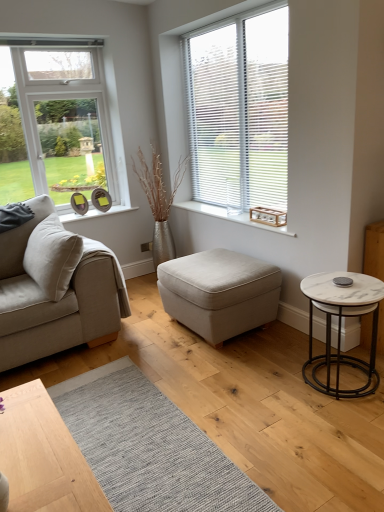
Identify the location of white blinds at upper right. (239, 111).

Image resolution: width=384 pixels, height=512 pixels. In order to click on light beige fabric ottoman at center in this screenshot , I will do `click(219, 292)`.

What is the approximate height of light beige fabric ottoman at center?

light beige fabric ottoman at center is 18.18 inches tall.

Identify the location of beige fabric couch at left. This screenshot has width=384, height=512. (55, 289).

Where is `white marble side table at right`? The image size is (384, 512). white marble side table at right is located at coordinates (340, 326).

I want to click on white blinds at upper right, so click(239, 111).

Between point (190, 324) and point (316, 368), which one is positioned behind?

Positioned behind is point (190, 324).

Is there a large distance between light beige fabric ottoman at center and white marble side table at right?

No, light beige fabric ottoman at center is in close proximity to white marble side table at right.

From a real-world perspective, is light beige fabric ottoman at center physically located above or below white marble side table at right?

In terms of real-world spatial position, light beige fabric ottoman at center is below white marble side table at right.

Which object is positioned more to the right, light beige fabric ottoman at center or white marble side table at right?

Positioned to the right is white marble side table at right.

Is beige fabric couch at left positioned with its back to white blinds at upper right?

That's not correct — beige fabric couch at left is not looking away from white blinds at upper right.

From a real-world perspective, is beige fabric couch at left on top of white blinds at upper right?

No, from a real-world perspective, beige fabric couch at left is not above white blinds at upper right.

Who is taller, beige fabric couch at left or white blinds at upper right?

white blinds at upper right.

Would you say white blinds at upper right is part of beige fabric couch at left's contents?

No, white blinds at upper right is not surrounded by beige fabric couch at left.

Considering the sizes of objects beige fabric couch at left and wooden crate at center in the image provided, who is shorter, beige fabric couch at left or wooden crate at center?

wooden crate at center.

Looking at the image, does beige fabric couch at left seem bigger or smaller compared to wooden crate at center?

Considering their sizes, beige fabric couch at left takes up more space than wooden crate at center.

Is beige fabric couch at left inside or outside of wooden crate at center?

beige fabric couch at left is spatially situated outside wooden crate at center.

From the image's perspective, is beige fabric couch at left over wooden crate at center?

No, from the image's perspective, beige fabric couch at left is not above wooden crate at center.

Considering their positions, is wooden crate at center located in front of or behind white blinds at upper right?

Visually, wooden crate at center is located behind white blinds at upper right.

The width and height of the screenshot is (384, 512). What are the coordinates of `window located above the wooden crate at center (from the image's perspective)` in the screenshot? It's located at (239, 111).

Is wooden crate at center smaller than white blinds at upper right?

Yes, wooden crate at center is smaller than white blinds at upper right.

Considering the sizes of objects white marble side table at right and light beige fabric ottoman at center in the image provided, who is thinner, white marble side table at right or light beige fabric ottoman at center?

white marble side table at right.

Which of these two, white marble side table at right or light beige fabric ottoman at center, stands shorter?

light beige fabric ottoman at center.

From a real-world perspective, who is located higher, white marble side table at right or light beige fabric ottoman at center?

white marble side table at right is physically above.

Based on the photo, in terms of height, does wooden crate at center look taller or shorter compared to light beige fabric ottoman at center?

A: wooden crate at center is shorter than light beige fabric ottoman at center.

Which is behind, wooden crate at center or light beige fabric ottoman at center?

Positioned behind is wooden crate at center.

This screenshot has height=512, width=384. I want to click on stool located underneath the wooden crate at center (from a real-world perspective), so click(219, 292).

Identify the location of window sill behind the white blinds at upper right. Image resolution: width=384 pixels, height=512 pixels. (231, 216).

Can you confirm if white blinds at upper right is bigger than wooden crate at center?

Indeed, white blinds at upper right has a larger size compared to wooden crate at center.

Considering the positions of objects white blinds at upper right and wooden crate at center in the image provided, who is more to the right, white blinds at upper right or wooden crate at center?

white blinds at upper right is more to the right.

From the image's perspective, relative to wooden crate at center, is white blinds at upper right above or below?

white blinds at upper right is above wooden crate at center.

Where is `coffee table in front of the light beige fabric ottoman at center`? Image resolution: width=384 pixels, height=512 pixels. coffee table in front of the light beige fabric ottoman at center is located at coordinates pyautogui.click(x=340, y=326).

I want to click on window that is behind the beige fabric couch at left, so click(239, 111).

Based on their spatial positions, is wooden crate at center or white marble side table at right further from light beige fabric ottoman at center?

Based on the image, white marble side table at right appears to be further to light beige fabric ottoman at center.

When comparing their distances from wooden crate at center, does beige fabric couch at left or white marble side table at right seem further?

beige fabric couch at left.

Based on their spatial positions, is white marble side table at right or beige fabric couch at left further from wooden crate at center?

beige fabric couch at left lies further to wooden crate at center than the other object.

Which object lies further to the anchor point beige fabric couch at left, white blinds at upper right or wooden crate at center?

white blinds at upper right lies further to beige fabric couch at left than the other object.

Looking at the image, which one is located further to light beige fabric ottoman at center, white blinds at upper right or white marble side table at right?

white blinds at upper right.

Which object lies further to the anchor point white marble side table at right, beige fabric couch at left or wooden crate at center?

beige fabric couch at left lies further to white marble side table at right than the other object.

Which object lies further to the anchor point white blinds at upper right, beige fabric couch at left or wooden crate at center?

beige fabric couch at left lies further to white blinds at upper right than the other object.

Estimate the real-world distances between objects in this image. Which object is closer to white blinds at upper right, white marble side table at right or light beige fabric ottoman at center?

light beige fabric ottoman at center lies closer to white blinds at upper right than the other object.

The width and height of the screenshot is (384, 512). In order to click on stool that lies between white blinds at upper right and white marble side table at right from top to bottom in this screenshot , I will do `click(219, 292)`.

The image size is (384, 512). Identify the location of stool located between beige fabric couch at left and wooden crate at center in the left-right direction. (219, 292).

You are a GUI agent. You are given a task and a screenshot of the screen. Output one action in this format:
    pyautogui.click(x=<x>, y=<y>)
    Task: Click on the stool between beige fabric couch at left and white blinds at upper right in the horizontal direction
    The image size is (384, 512).
    Given the screenshot: What is the action you would take?
    pyautogui.click(x=219, y=292)

Image resolution: width=384 pixels, height=512 pixels. What are the coordinates of `window sill between white blinds at upper right and white marble side table at right in the vertical direction` in the screenshot? It's located at (231, 216).